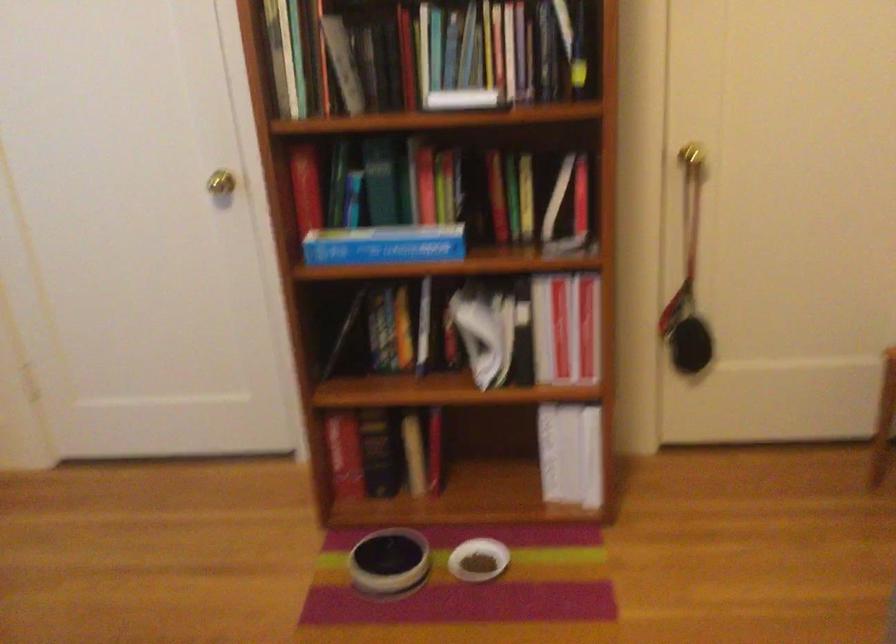
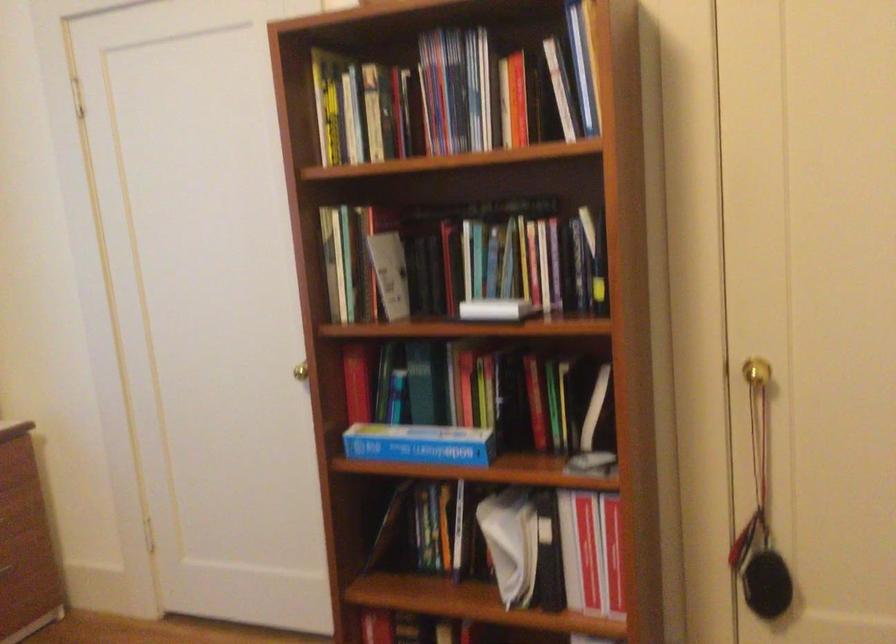
Question: Which direction would the cameraman need to move to produce the second image? Reply with the corresponding letter.

Choices:
 (A) Left
 (B) Right
 (C) Forward
 (D) Backward

Answer: (B)